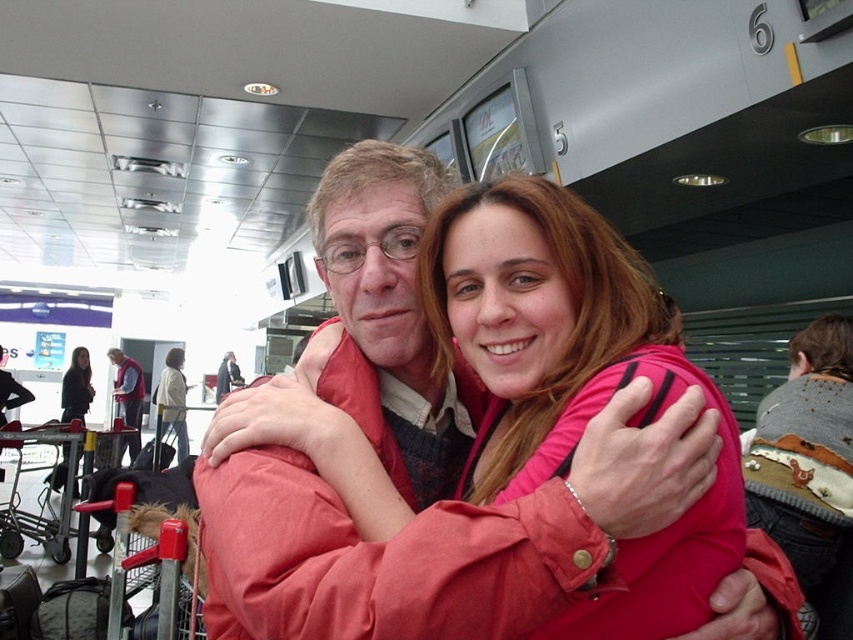
Question: Which point is farther to the camera?

Choices:
 (A) black leather jacket at left
 (B) light beige sweater at center
 (C) matte gray vest at center
 (D) pink fabric at center

Answer: (C)

Question: Which point is closer to the camera?

Choices:
 (A) pink fabric at center
 (B) matte gray vest at center
 (C) black leather jacket at left

Answer: (A)

Question: Is light beige sweater at center above black leather jacket at left?

Choices:
 (A) yes
 (B) no

Answer: (B)

Question: Is pink fabric at center smaller than matte gray vest at center?

Choices:
 (A) yes
 (B) no

Answer: (A)

Question: Does pink fabric at center have a smaller size compared to matte gray vest at center?

Choices:
 (A) no
 (B) yes

Answer: (B)

Question: Which point is closer to the camera?

Choices:
 (A) (635, 372)
 (B) (181, 358)
 (C) (113, 349)

Answer: (A)